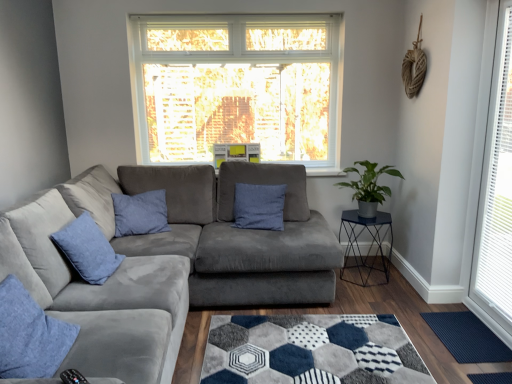
Find the location of a particular element. The image size is (512, 384). dark blue rubber mat at lower right is located at coordinates (467, 337).

This screenshot has height=384, width=512. Describe the element at coordinates (167, 261) in the screenshot. I see `suede gray couch at center` at that location.

Find the location of a particular element. This screenshot has width=512, height=384. green matte plant at right is located at coordinates (369, 186).

Consider the image. Would you say metallic blue cocktail table at right is outside white plastic window at right?

Absolutely, metallic blue cocktail table at right is external to white plastic window at right.

Is metallic blue cocktail table at right positioned with its back to white plastic window at right?

No, metallic blue cocktail table at right is not facing away from white plastic window at right.

Who is taller, metallic blue cocktail table at right or white plastic window at right?

Standing taller between the two is white plastic window at right.

Considering the relative positions of metallic blue cocktail table at right and white plastic window at right in the image provided, is metallic blue cocktail table at right to the left or to the right of white plastic window at right?

Clearly, metallic blue cocktail table at right is on the left of white plastic window at right in the image.

Is blue velvet pillow at left, the 1th pillow positioned from the left, facing away from dark blue rubber mat at lower right?

No, blue velvet pillow at left, the 1th pillow positioned from the left, is not facing away from dark blue rubber mat at lower right.

Is blue velvet pillow at left, the 1th pillow positioned from the left, at the right side of dark blue rubber mat at lower right?

Incorrect, blue velvet pillow at left, the 1th pillow positioned from the left, is not on the right side of dark blue rubber mat at lower right.

Which object is wider, blue velvet pillow at left, the 3th pillow when ordered from right to left, or dark blue rubber mat at lower right?

dark blue rubber mat at lower right.

Is metallic blue cocktail table at right surrounding blue cotton pillow at center, arranged as the third pillow when viewed from the front?

No, blue cotton pillow at center, arranged as the third pillow when viewed from the front, is located outside of metallic blue cocktail table at right.

Could you tell me if metallic blue cocktail table at right is facing blue cotton pillow at center, the third pillow in the left-to-right sequence?

No, metallic blue cocktail table at right is not oriented towards blue cotton pillow at center, the third pillow in the left-to-right sequence.

In order to click on cocktail table below the blue cotton pillow at center, arranged as the first pillow when viewed from the back (from the image's perspective) in this screenshot , I will do `click(370, 245)`.

Which of these two, blue velvet pillow at left, acting as the 2th pillow starting from the back, or suede gray couch at center, stands taller?

With more height is suede gray couch at center.

Based on their positions, is blue velvet pillow at left, acting as the 2th pillow starting from the front, located to the left or right of suede gray couch at center?

In the image, blue velvet pillow at left, acting as the 2th pillow starting from the front, appears on the left side of suede gray couch at center.

From a real-world perspective, is blue velvet pillow at left, acting as the 2th pillow starting from the front, located higher than suede gray couch at center?

Indeed, from a real-world perspective, blue velvet pillow at left, acting as the 2th pillow starting from the front, stands above suede gray couch at center.

Where is `houseplant that is above the blue cotton pillow at center, the third pillow in the left-to-right sequence (from a real-world perspective)`? houseplant that is above the blue cotton pillow at center, the third pillow in the left-to-right sequence (from a real-world perspective) is located at coordinates (369, 186).

From the image's perspective, is blue cotton pillow at center, arranged as the first pillow when viewed from the back, beneath green matte plant at right?

Indeed, from the image's perspective, blue cotton pillow at center, arranged as the first pillow when viewed from the back, is shown beneath green matte plant at right.

Does blue cotton pillow at center, arranged as the first pillow when viewed from the back, have a lesser height compared to green matte plant at right?

No, blue cotton pillow at center, arranged as the first pillow when viewed from the back, is not shorter than green matte plant at right.

From a real-world perspective, does blue cotton pillow at center, which is the first pillow from right to left, stand above green matte plant at right?

Actually, blue cotton pillow at center, which is the first pillow from right to left, is physically below green matte plant at right in the real world.

Would you say metallic blue cocktail table at right is inside or outside blue velvet pillow at left, acting as the 2th pillow starting from the front?

metallic blue cocktail table at right is not inside blue velvet pillow at left, acting as the 2th pillow starting from the front, it's outside.

Between metallic blue cocktail table at right and blue velvet pillow at left, acting as the 2th pillow starting from the back, which one appears on the right side from the viewer's perspective?

From the viewer's perspective, metallic blue cocktail table at right appears more on the right side.

Which of these two, green matte plant at right or white plastic window at right, stands taller?

With more height is white plastic window at right.

From a real-world perspective, is green matte plant at right physically located above or below white plastic window at right?

Clearly, from a real-world perspective, green matte plant at right is below white plastic window at right.

Considering the sizes of objects green matte plant at right and white plastic window at right in the image provided, who is thinner, green matte plant at right or white plastic window at right?

white plastic window at right is thinner.

Is green matte plant at right oriented towards white plastic window at right?

No, green matte plant at right does not turn towards white plastic window at right.

The height and width of the screenshot is (384, 512). What are the coordinates of `cocktail table below the white plastic window at right (from the image's perspective)` in the screenshot? It's located at (370, 245).

In order to click on pillow that is the 1st one when counting forward from the dark blue rubber mat at lower right in this screenshot , I will do [x=87, y=249].

Which object lies further to the anchor point green matte plant at right, suede gray couch at center or blue cotton pillow at center, which is the first pillow from right to left?

suede gray couch at center is positioned further to the anchor green matte plant at right.

Which object lies nearer to the anchor point metallic blue cocktail table at right, suede gray couch at center or blue cotton pillow at center, arranged as the first pillow when viewed from the back?

Based on the image, blue cotton pillow at center, arranged as the first pillow when viewed from the back, appears to be nearer to metallic blue cocktail table at right.

From the image, which object appears to be nearer to dark blue rubber mat at lower right, blue velvet pillow at left, the 1th pillow positioned from the left, or white plastic window at right?

Among the two, white plastic window at right is located nearer to dark blue rubber mat at lower right.

When comparing their distances from white plastic window at right, does suede gray couch at center or metallic blue cocktail table at right seem closer?

metallic blue cocktail table at right.

When comparing their distances from blue cotton pillow at center, arranged as the third pillow when viewed from the front, does green matte plant at right or dark blue rubber mat at lower right seem closer?

green matte plant at right is positioned closer to the anchor blue cotton pillow at center, arranged as the third pillow when viewed from the front.

Based on their spatial positions, is blue cotton pillow at center, arranged as the first pillow when viewed from the back, or green matte plant at right closer to dark blue rubber mat at lower right?

Based on the image, green matte plant at right appears to be nearer to dark blue rubber mat at lower right.

Based on their spatial positions, is green matte plant at right or white plastic window at right further from denim cushion at lower left, the first pillow positioned from the front?

Based on the image, white plastic window at right appears to be further to denim cushion at lower left, the first pillow positioned from the front.

Looking at the image, which one is located closer to green matte plant at right, blue velvet pillow at left, the 1th pillow positioned from the left, or suede gray couch at center?

Among the two, suede gray couch at center is located nearer to green matte plant at right.

The width and height of the screenshot is (512, 384). Identify the location of cocktail table between blue velvet pillow at left, acting as the 2th pillow starting from the back, and white plastic window at right, in the horizontal direction. (370, 245).

Locate an element on the screen. studio couch situated between denim cushion at lower left, the first pillow positioned from the front, and dark blue rubber mat at lower right from left to right is located at coordinates (167, 261).

I want to click on houseplant between denim cushion at lower left, the 3th pillow in the back-to-front sequence, and white plastic window at right from left to right, so click(369, 186).

Image resolution: width=512 pixels, height=384 pixels. Find the location of `houseplant between white plastic window at right and metallic blue cocktail table at right in the front-back direction`. houseplant between white plastic window at right and metallic blue cocktail table at right in the front-back direction is located at coordinates (369, 186).